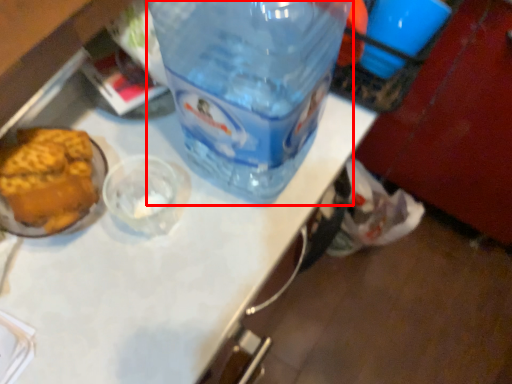
Question: Observing the image, what is the correct spatial positioning of bottle (annotated by the red box) in reference to table top?

Choices:
 (A) right
 (B) left

Answer: (B)